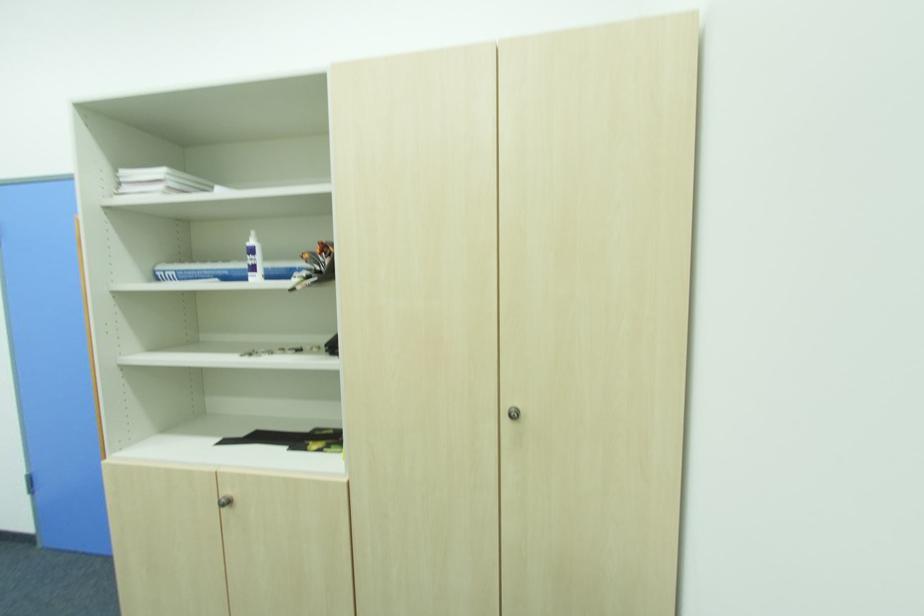
Describe the element at coordinates (513, 413) in the screenshot. The height and width of the screenshot is (616, 924). I see `the cabinet keyhole` at that location.